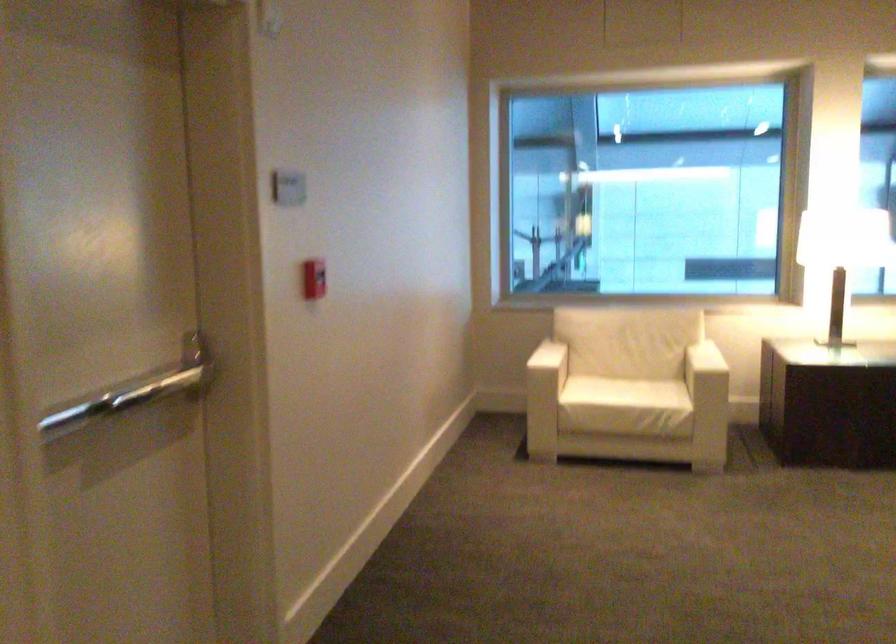
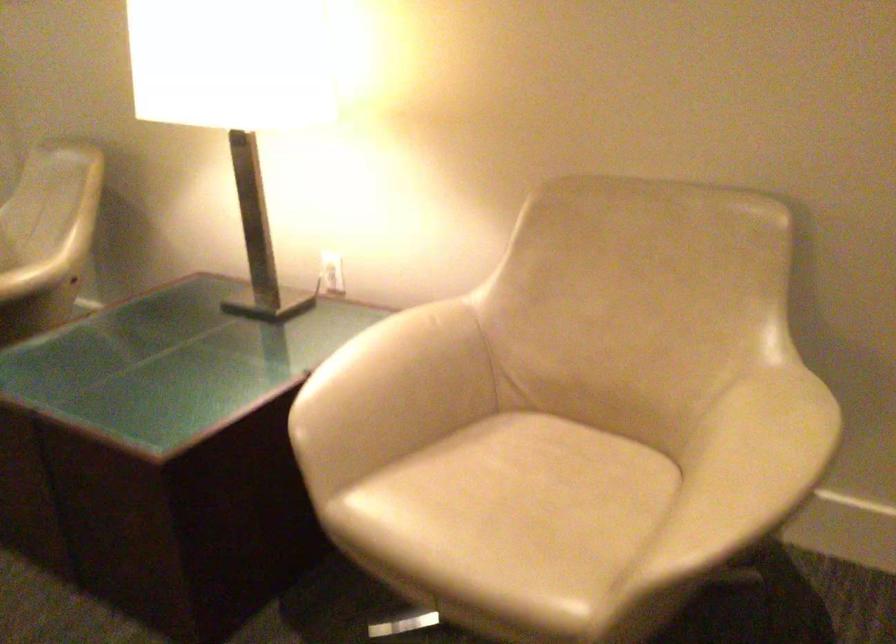
The first image is from the beginning of the video and the second image is from the end. How did the camera likely rotate when shooting the video?

The camera's rotation is toward left-down.